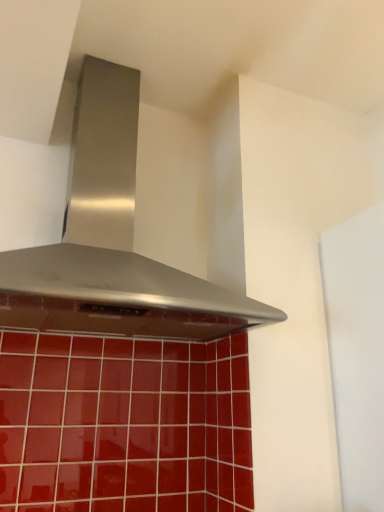
Question: Should I look upward or downward to see stainless steel range hood at center?

Choices:
 (A) up
 (B) down

Answer: (A)